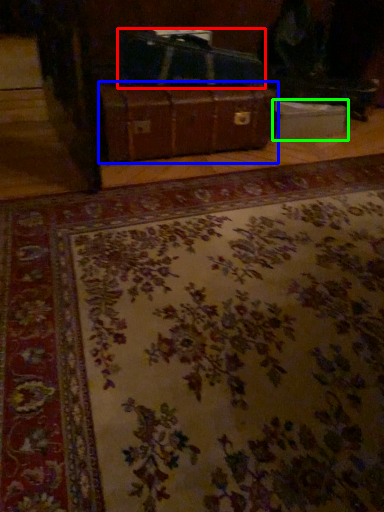
Question: Based on their relative distances, which object is farther from luggage (highlighted by a red box)? Choose from suitcase (highlighted by a blue box) and cardboard box (highlighted by a green box).

Choices:
 (A) suitcase
 (B) cardboard box

Answer: (B)